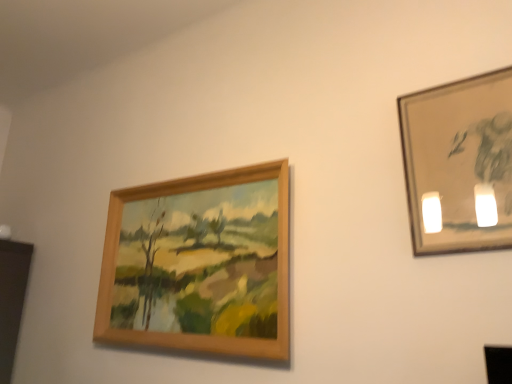
Question: From a real-world perspective, is metallic silver frame at upper right, the 2th picture frame viewed from the back, physically above wooden frame at upper left, which is the first picture frame in left-to-right order?

Choices:
 (A) no
 (B) yes

Answer: (B)

Question: Is metallic silver frame at upper right, the 2th picture frame viewed from the back, at the right side of wooden frame at upper left, arranged as the 2th picture frame when viewed from the right?

Choices:
 (A) no
 (B) yes

Answer: (B)

Question: Does metallic silver frame at upper right, marked as the first picture frame in a front-to-back arrangement, contain wooden frame at upper left, arranged as the 2th picture frame when viewed from the right?

Choices:
 (A) yes
 (B) no

Answer: (B)

Question: From the image's perspective, is metallic silver frame at upper right, marked as the first picture frame in a front-to-back arrangement, above wooden frame at upper left, arranged as the 2th picture frame when viewed from the right?

Choices:
 (A) no
 (B) yes

Answer: (B)

Question: Is the depth of metallic silver frame at upper right, marked as the first picture frame in a front-to-back arrangement, greater than that of wooden frame at upper left, the first picture frame from the back?

Choices:
 (A) no
 (B) yes

Answer: (A)

Question: Can you confirm if metallic silver frame at upper right, marked as the first picture frame in a front-to-back arrangement, is thinner than wooden frame at upper left, the 2th picture frame positioned from the front?

Choices:
 (A) no
 (B) yes

Answer: (B)

Question: Is wooden frame at upper left, which is the first picture frame in left-to-right order, with metallic silver frame at upper right, the 2th picture frame viewed from the back?

Choices:
 (A) yes
 (B) no

Answer: (B)

Question: Does wooden frame at upper left, arranged as the 2th picture frame when viewed from the right, lie behind metallic silver frame at upper right, the second picture frame from the left?

Choices:
 (A) yes
 (B) no

Answer: (A)

Question: Considering the relative sizes of wooden frame at upper left, the first picture frame from the back, and metallic silver frame at upper right, the 2th picture frame viewed from the back, in the image provided, is wooden frame at upper left, the first picture frame from the back, shorter than metallic silver frame at upper right, the 2th picture frame viewed from the back,?

Choices:
 (A) yes
 (B) no

Answer: (B)

Question: Can you confirm if wooden frame at upper left, arranged as the 2th picture frame when viewed from the right, is taller than metallic silver frame at upper right, marked as the first picture frame in a front-to-back arrangement?

Choices:
 (A) no
 (B) yes

Answer: (B)

Question: Is wooden frame at upper left, the 2th picture frame positioned from the front, positioned beyond the bounds of metallic silver frame at upper right, the 1th picture frame when ordered from right to left?

Choices:
 (A) no
 (B) yes

Answer: (B)

Question: From a real-world perspective, is wooden frame at upper left, the 2th picture frame positioned from the front, positioned over metallic silver frame at upper right, marked as the first picture frame in a front-to-back arrangement, based on gravity?

Choices:
 (A) no
 (B) yes

Answer: (A)

Question: Is point [458, 210] closer or farther from the camera than point [133, 271]?

Choices:
 (A) farther
 (B) closer

Answer: (B)